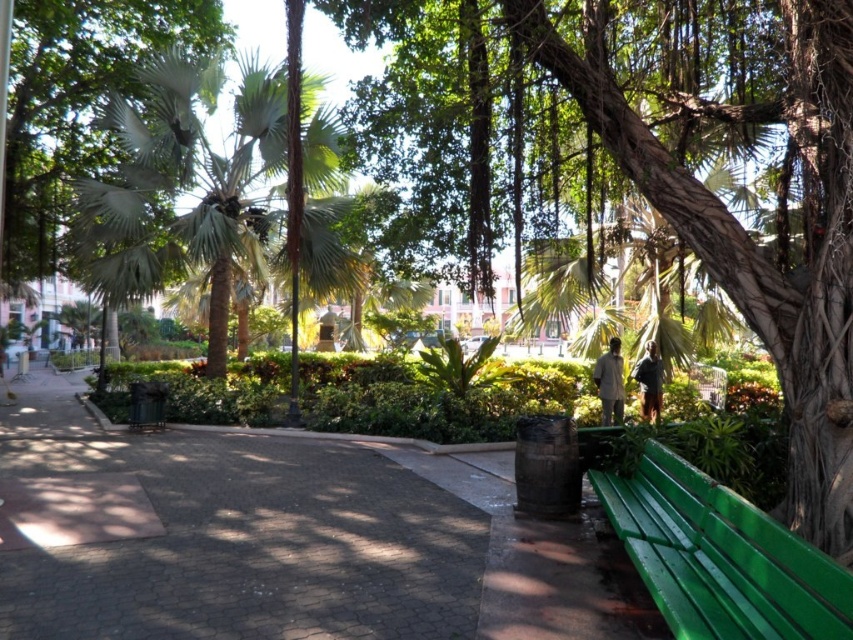
You are standing at the green metal bench on the right side of the pathway and want to walk to the point marked as point (604, 406). However, there is an obstacle at point marked as point (728, 216). Will you encounter this obstacle before reaching your destination?

Yes, you will encounter the obstacle at point (728, 216) before reaching point (604, 406) because point (728, 216) is in front of point (604, 406).

You are a visitor in the park and want to sit on the green painted wood bench at lower right. Can you easily reach it from where you are standing without stepping over the brown fabric jacket at lower right?

The green painted wood bench at lower right is in front of brown fabric jacket at lower right, so you can easily reach the bench without needing to step over the jacket since it is already positioned in front of it.